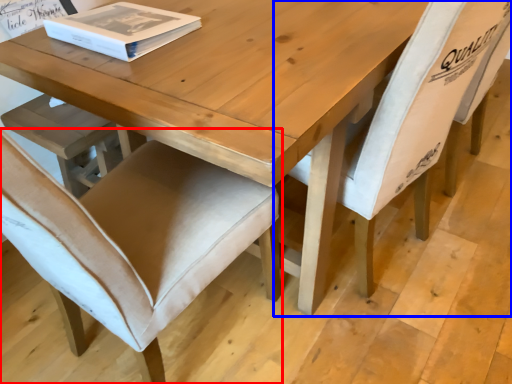
Question: Among these objects, which one is nearest to the camera, chair (highlighted by a red box) or chair (highlighted by a blue box)?

Choices:
 (A) chair
 (B) chair

Answer: (A)